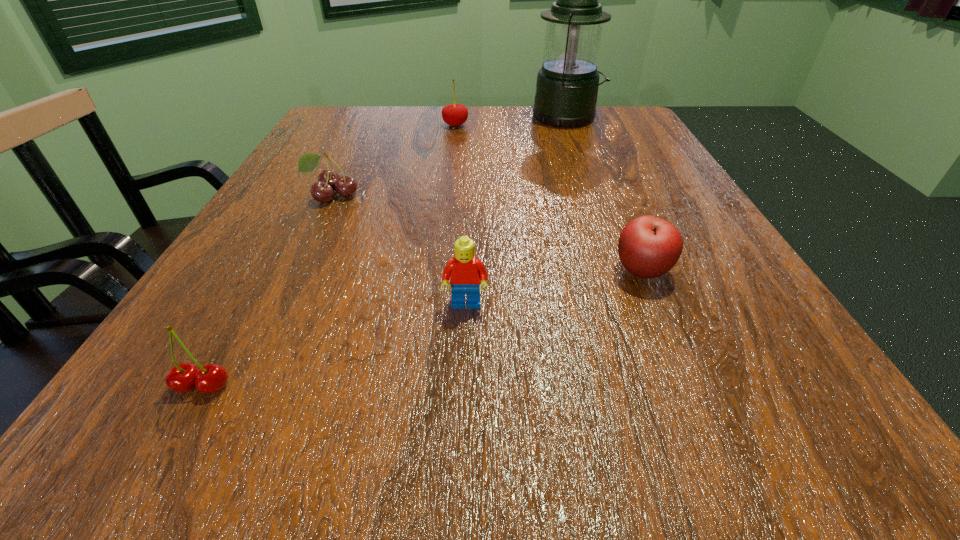
Image resolution: width=960 pixels, height=540 pixels. I want to click on vacant space at the near edge, so click(384, 440).

The image size is (960, 540). I want to click on free space at the left edge, so click(x=290, y=169).

Image resolution: width=960 pixels, height=540 pixels. I want to click on free space at the right edge, so click(749, 328).

Where is `vacant area at the far left corner of the desktop`? vacant area at the far left corner of the desktop is located at coordinates (322, 117).

The width and height of the screenshot is (960, 540). In the image, there is a desktop. Identify the location of free region at the near left corner. (100, 438).

At what (x,y) coordinates should I click in order to perform the action: click on free space that is in between the tallest cherry and the nearest object. Please return your answer as a coordinate pair (x, y). This screenshot has height=540, width=960. Looking at the image, I should click on (329, 255).

Identify the location of free area in between the fourth farthest object and the rightmost cherry. The height and width of the screenshot is (540, 960). [548, 198].

What are the coordinates of `empty space between the nearest object and the apple` in the screenshot? It's located at (422, 328).

Locate an element on the screen. The width and height of the screenshot is (960, 540). free point between the second nearest cherry and the lantern is located at coordinates (449, 157).

Find the location of a particular element. Image resolution: width=960 pixels, height=540 pixels. vacant point located between the fourth farthest object and the nearest object is located at coordinates (422, 328).